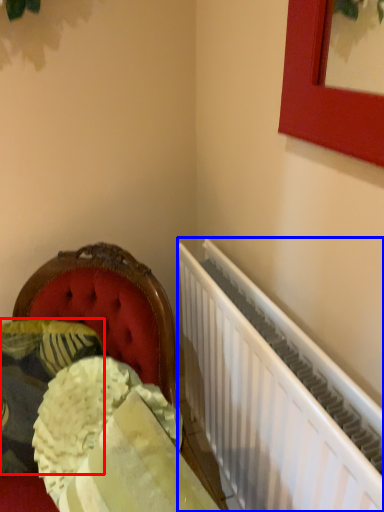
Question: Which point is closer to the camera, pillow (highlighted by a red box) or radiator (highlighted by a blue box)?

Choices:
 (A) pillow
 (B) radiator

Answer: (B)